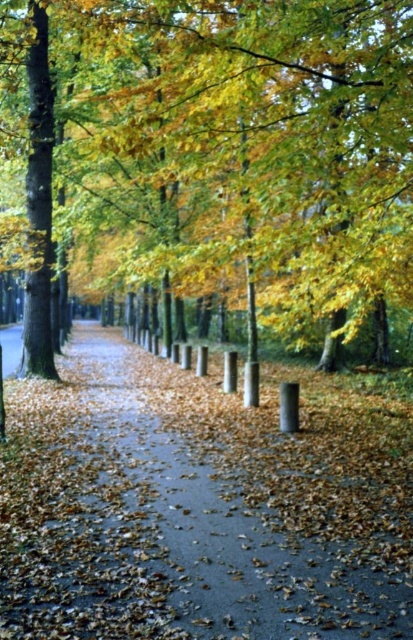
Does golden leafy tree at center have a lesser height compared to smooth asphalt pavement at center?

No.

Between golden leafy tree at center and smooth asphalt pavement at center, which one appears on the left side from the viewer's perspective?

A: golden leafy tree at center

Is point (272, 118) farther from camera compared to point (33, 401)?

No.

The image size is (413, 640). What are the coordinates of `golden leafy tree at center` in the screenshot? It's located at (216, 156).